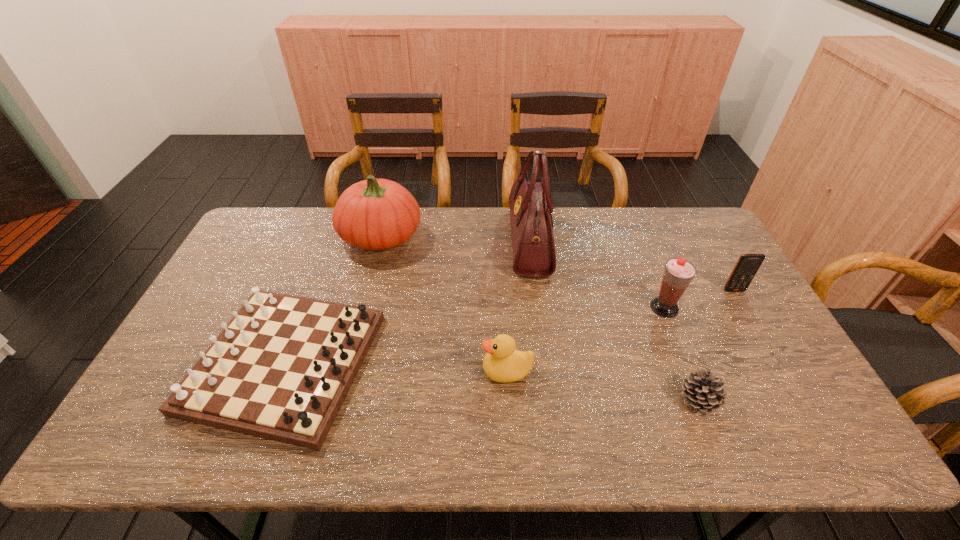
Find the location of a particular element. This screenshot has width=960, height=540. blank region between the cellular telephone and the pinecone is located at coordinates (716, 345).

Locate an element on the screen. The height and width of the screenshot is (540, 960). free space between the tallest object and the fifth shortest object is located at coordinates (597, 275).

This screenshot has height=540, width=960. Identify the location of free point between the fifth shortest object and the handbag. (597, 275).

At what (x,y) coordinates should I click in order to perform the action: click on free space between the pinecone and the tallest object. Please return your answer as a coordinate pair (x, y). The width and height of the screenshot is (960, 540). Looking at the image, I should click on (614, 321).

In order to click on vacant area between the chessboard and the fifth shortest object in this screenshot , I will do `click(475, 335)`.

At what (x,y) coordinates should I click in order to perform the action: click on unoccupied position between the smoothie and the duck. Please return your answer as a coordinate pair (x, y). This screenshot has width=960, height=540. Looking at the image, I should click on (586, 339).

Locate an element on the screen. The width and height of the screenshot is (960, 540). free space between the pumpkin and the handbag is located at coordinates (455, 239).

At what (x,y) coordinates should I click in order to perform the action: click on the second closest object to the cellular telephone. Please return your answer as a coordinate pair (x, y). The image size is (960, 540). Looking at the image, I should click on (703, 392).

Choose which object is the second nearest neighbor to the cellular telephone. Please provide its 2D coordinates. Your answer should be formatted as a tuple, i.e. [(x, y)], where the tuple contains the x and y coordinates of a point satisfying the conditions above.

[(703, 392)]

Image resolution: width=960 pixels, height=540 pixels. What are the coordinates of `vacant space that satisfies the following two spatial constraints: 1. on the front-facing side of the pinecone; 2. on the left side of the tallest object` in the screenshot? It's located at (549, 400).